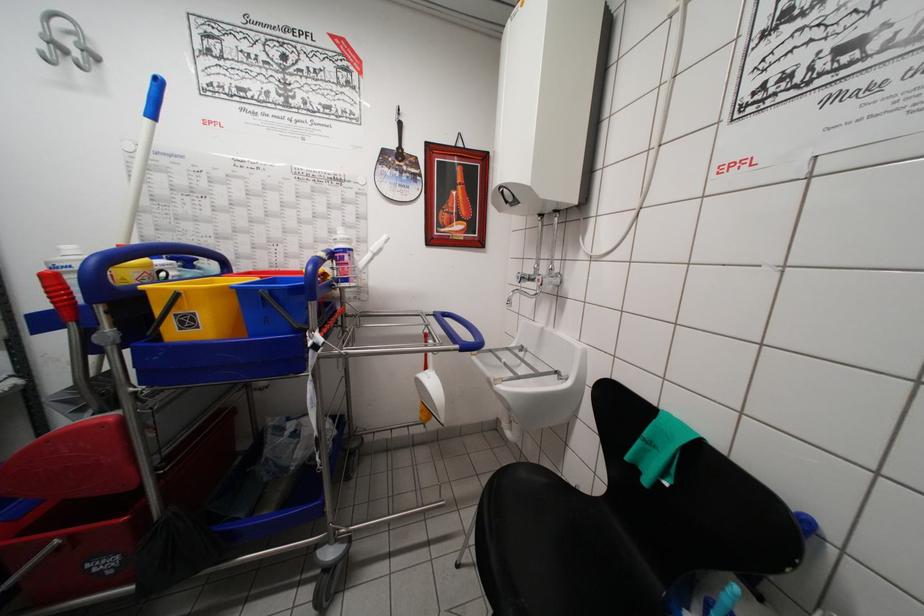
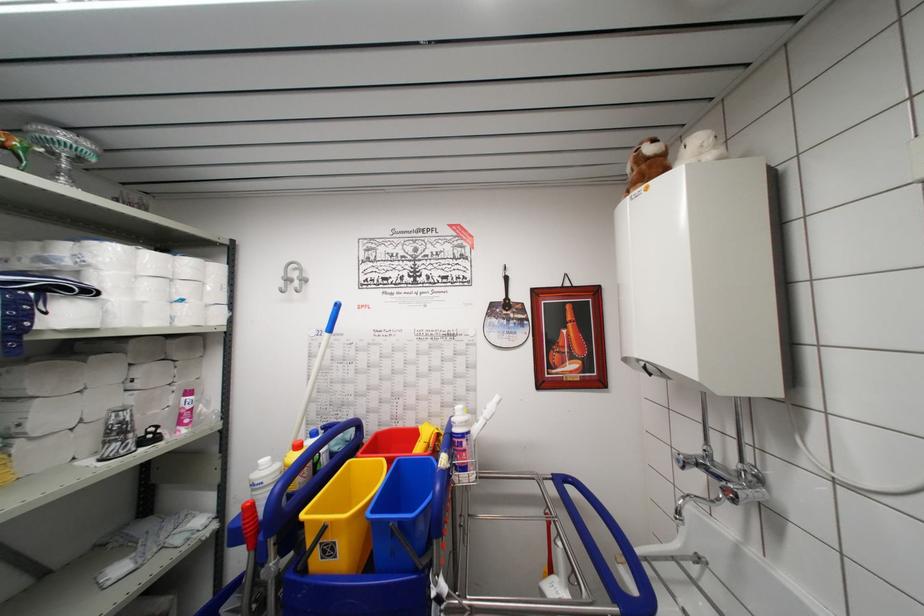
Question: I am providing you with two images of the same scene from different viewpoints. Please identify which objects are invisible in image2.

Choices:
 (A) blue cart handle
 (B) black fan
 (C) blue bucket
 (D) none of these

Answer: (D)